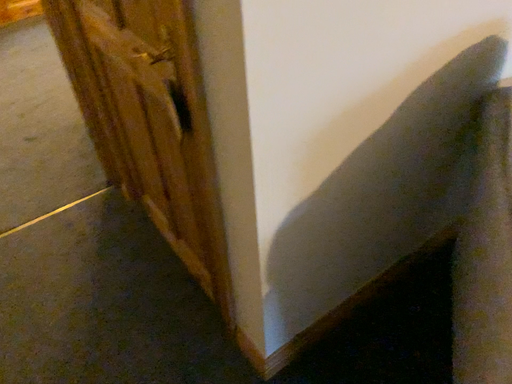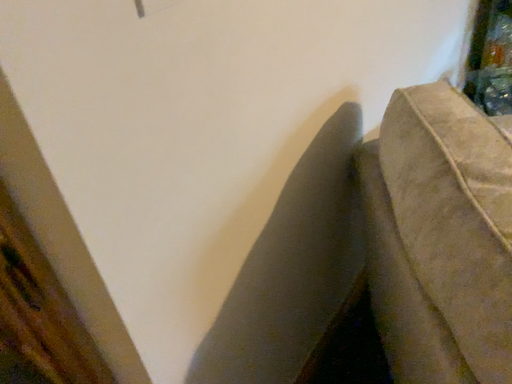
Question: How did the camera likely rotate when shooting the video?

Choices:
 (A) rotated downward
 (B) rotated upward

Answer: (B)